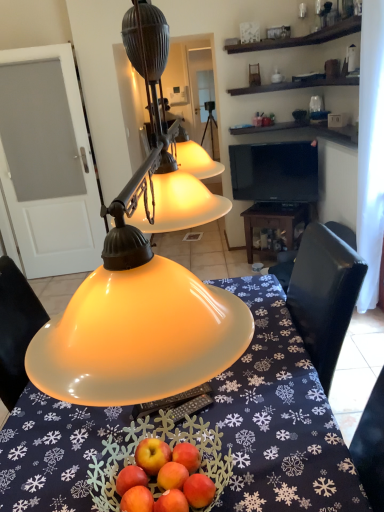
Question: Relative to matte yellow glass lampshade at center, is black glossy tv at upper center in front or behind?

Choices:
 (A) behind
 (B) front

Answer: (A)

Question: Is black glossy tv at upper center spatially inside matte yellow glass lampshade at center, or outside of it?

Choices:
 (A) outside
 (B) inside

Answer: (A)

Question: Estimate the real-world distances between objects in this image. Which object is farther from the black glossy tv at upper center?

Choices:
 (A) wooden table at center
 (B) matte yellow glass lampshade at center
 (C) translucent glass bowl at center

Answer: (B)

Question: Which object is positioned closest to the black glossy tv at upper center?

Choices:
 (A) wooden table at center
 (B) translucent glass bowl at center
 (C) matte yellow glass lampshade at center

Answer: (A)